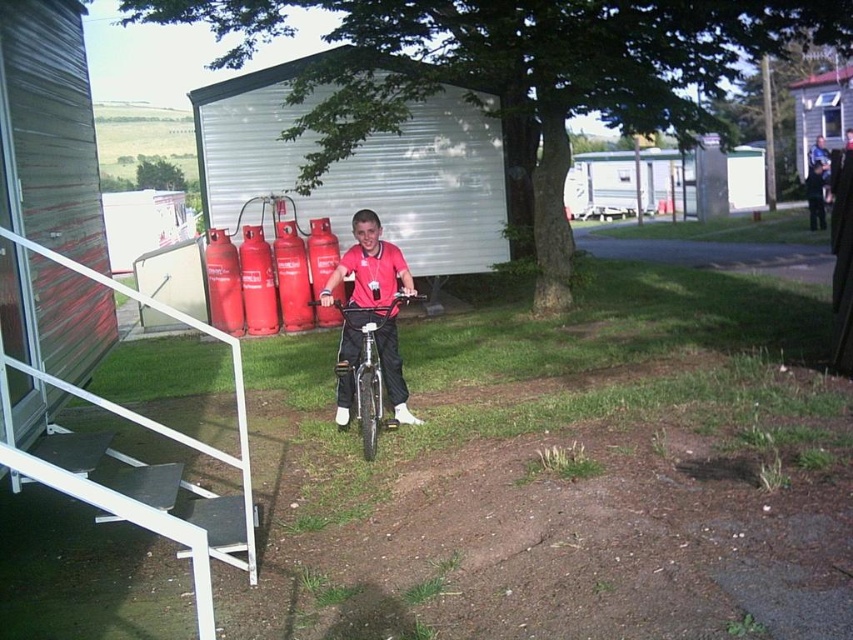
You are standing at the position of the young boy on the bicycle. You want to hang a banner between the brushed metal pole at upper right and the blue denim shirt at upper right. Can you do this without the banner touching the ground?

The distance between the brushed metal pole at upper right and the blue denim shirt at upper right is 3.33 meters. Since the banner would need to be suspended between two points, and the blue denim shirt is an article of clothing worn by a person, it is not a fixed structure to anchor the banner. Therefore, you cannot securely hang the banner between them without it touching the ground.